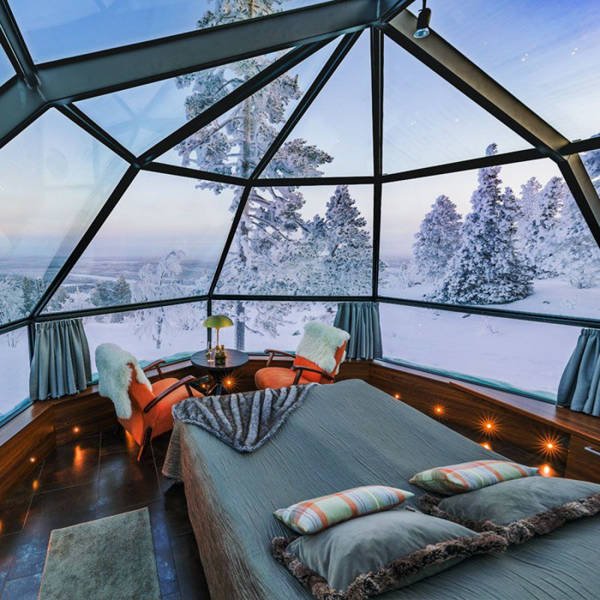
Locate an element on the screen. Image resolution: width=600 pixels, height=600 pixels. brown mat is located at coordinates (130, 552).